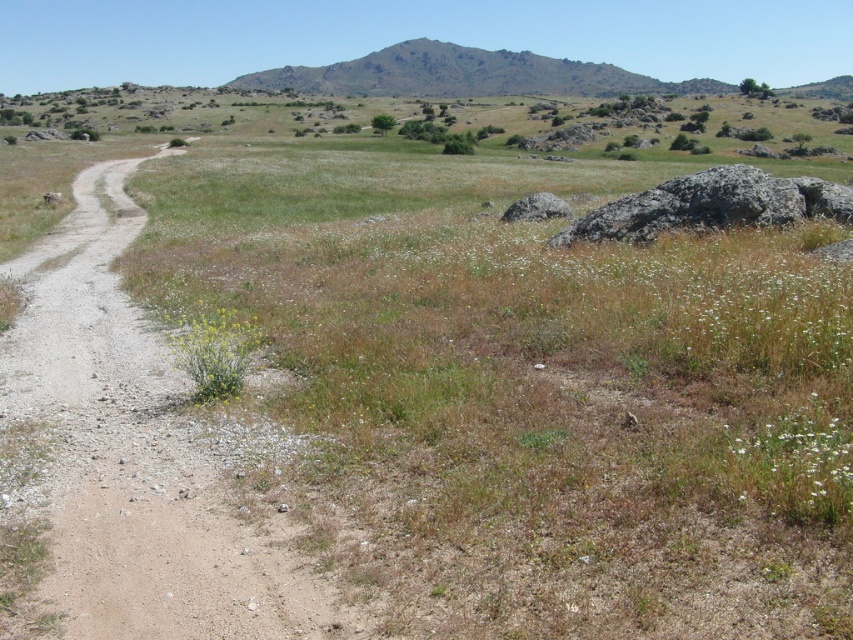
You are standing at the point labeled point (131,536) and want to walk to the point labeled point (198,401). Given the terrain described, will you have to walk uphill or downhill?

Since point (131,536) is closer to the camera than point (198,401), you are currently at a higher elevation. Therefore, you will have to walk downhill to reach the point (198,401).